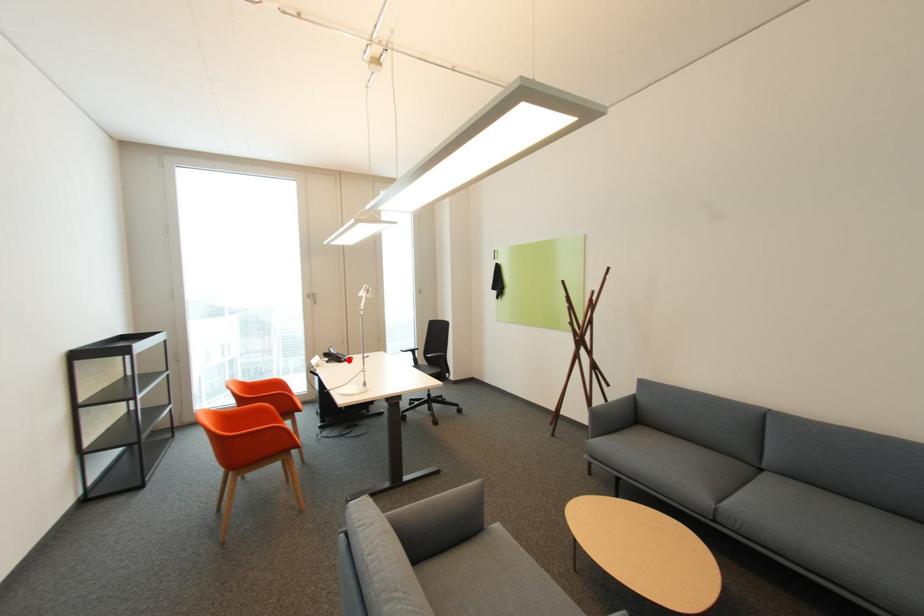
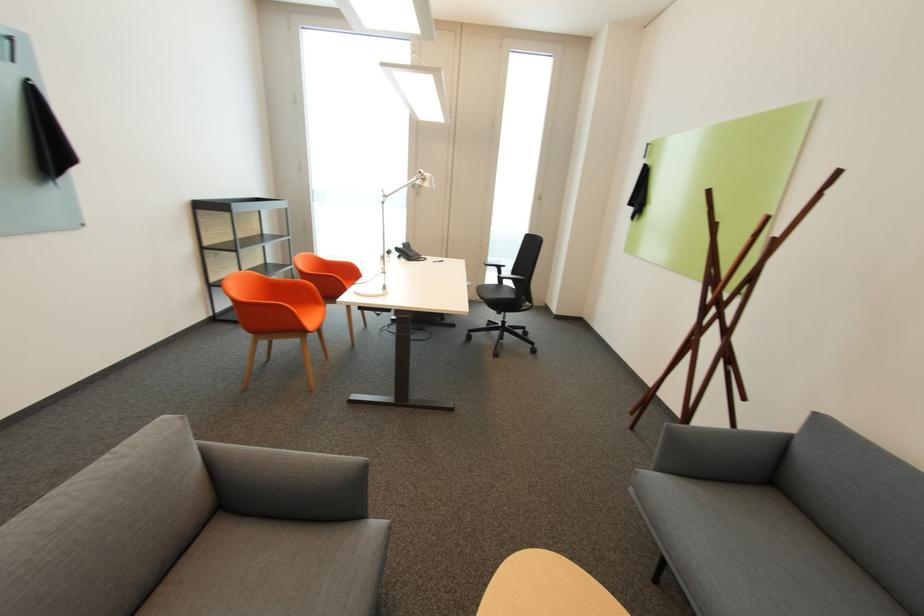
Question: I am providing you with two images of the same scene from different viewpoints. A red point is marked on the first image. At the location where the point appears in image 1, is it still visible in image 2?

Choices:
 (A) Yes
 (B) No

Answer: (A)